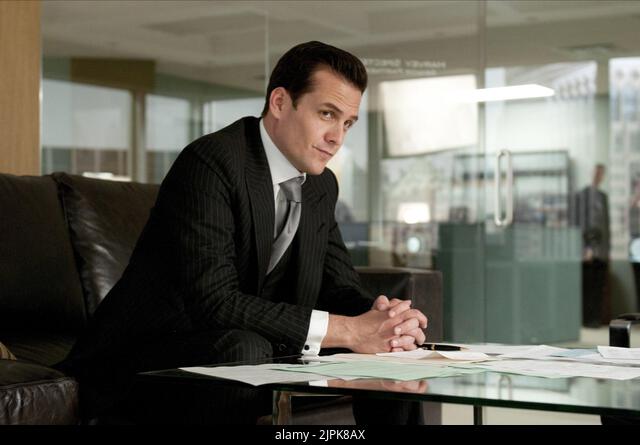
Identify the location of black leather seat. This screenshot has width=640, height=445. (45, 217).